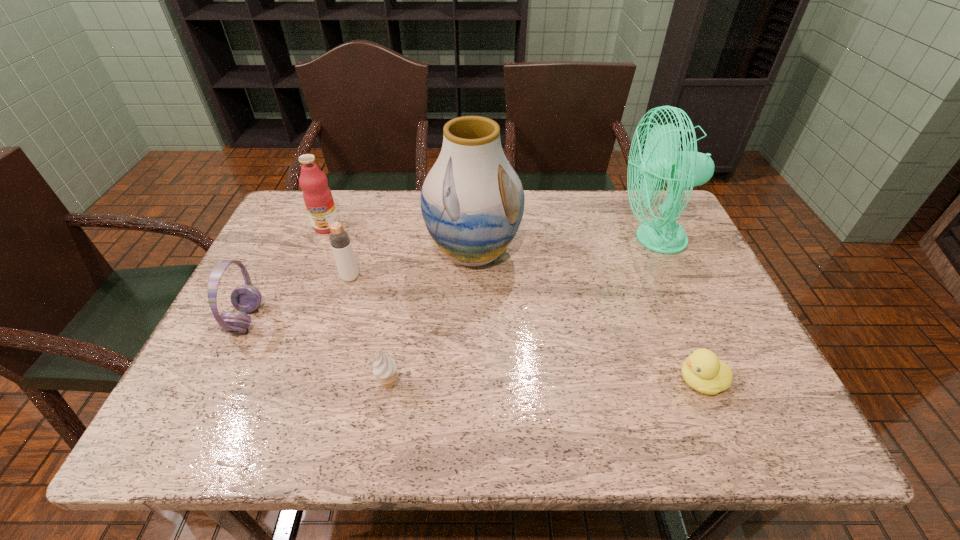
Where is `vacant area situated 0.260m at the beak of the shortest object`? This screenshot has height=540, width=960. vacant area situated 0.260m at the beak of the shortest object is located at coordinates (550, 381).

Find the location of a particular element. The height and width of the screenshot is (540, 960). fan at the far edge is located at coordinates (661, 158).

What are the coordinates of `vase positioned at the far edge` in the screenshot? It's located at (472, 201).

The width and height of the screenshot is (960, 540). I want to click on fruit juice positioned at the far edge, so click(317, 196).

Where is `fruit juice situated at the left edge`? The height and width of the screenshot is (540, 960). fruit juice situated at the left edge is located at coordinates (317, 196).

You are a GUI agent. You are given a task and a screenshot of the screen. Output one action in this format:
    pyautogui.click(x=<x>, y=<y>)
    Task: Click on the headset positioned at the left edge
    The height and width of the screenshot is (540, 960).
    Given the screenshot: What is the action you would take?
    pyautogui.click(x=246, y=298)

You are a GUI agent. You are given a task and a screenshot of the screen. Output one action in this format:
    pyautogui.click(x=<x>, y=<y>)
    Task: Click on the fan that is at the right edge
    This screenshot has width=960, height=540.
    Given the screenshot: What is the action you would take?
    pyautogui.click(x=661, y=158)

Identify the location of duckling that is at the right edge. The height and width of the screenshot is (540, 960). 702,370.

This screenshot has width=960, height=540. Identify the location of object situated at the far left corner. (317, 196).

At what (x,y) coordinates should I click in order to perform the action: click on object located in the far right corner section of the desktop. Please return your answer as a coordinate pair (x, y). Looking at the image, I should click on (661, 158).